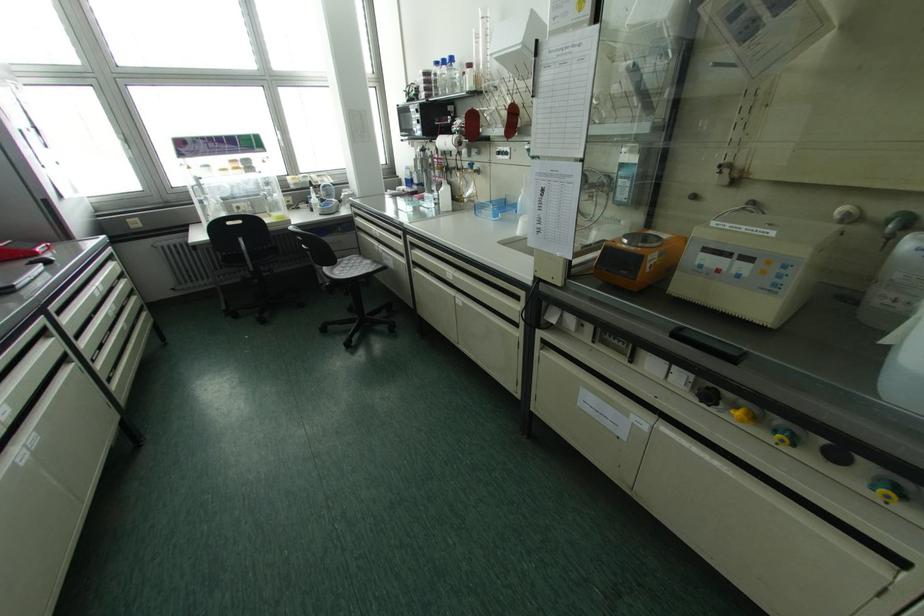
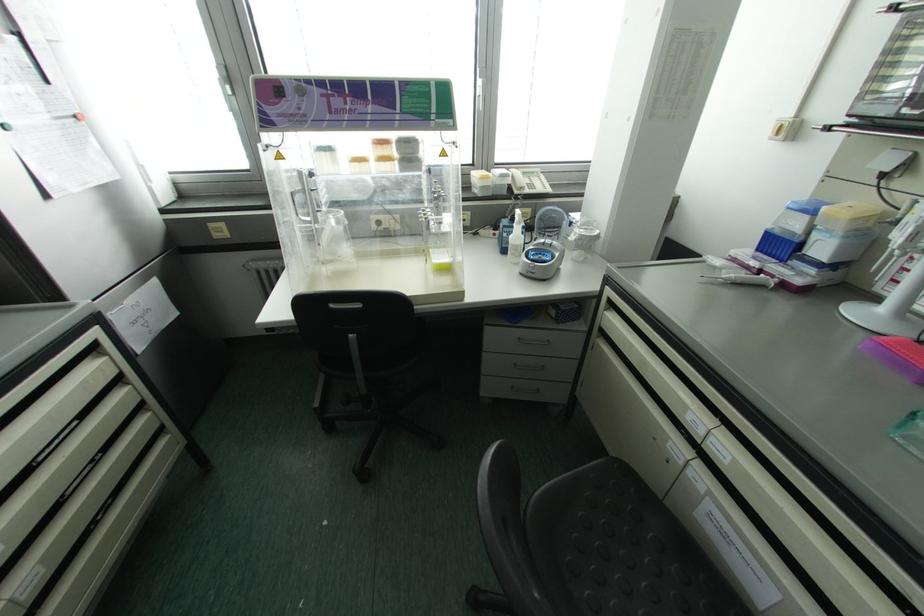
Find the pixel in the second image that matches point 311,209 in the first image.

(504, 251)